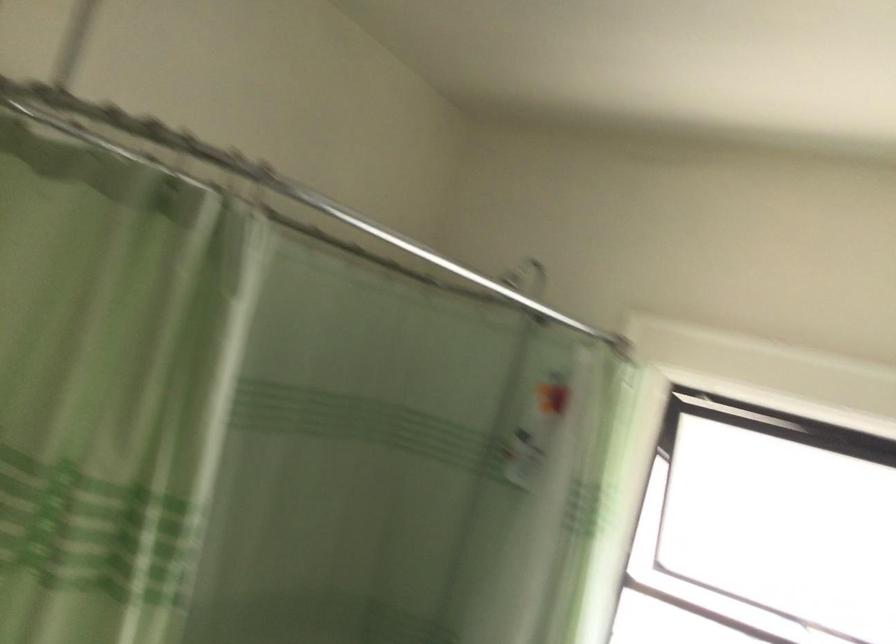
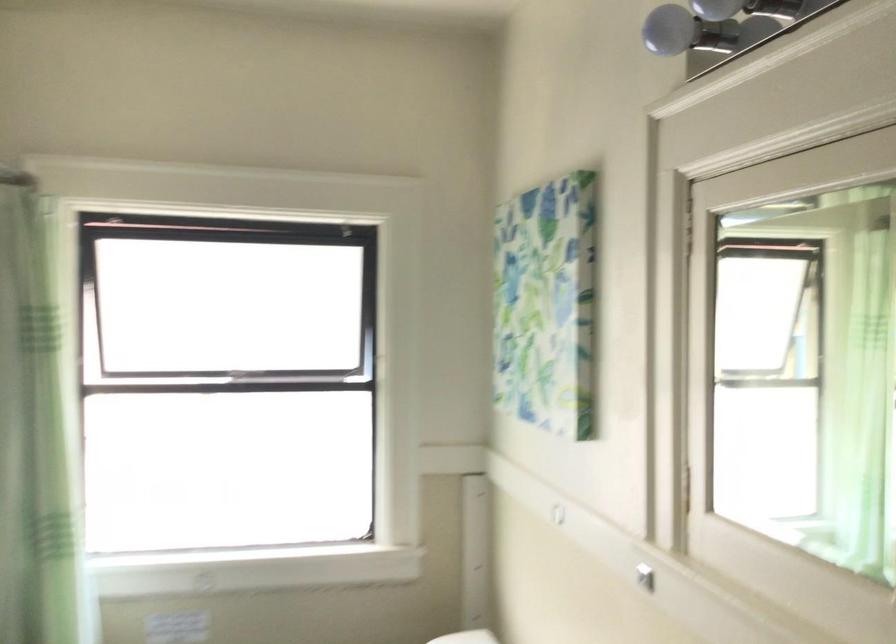
Question: The images are taken continuously from a first-person perspective. In which direction is your viewpoint rotating?

Choices:
 (A) Left
 (B) Right
 (C) Up
 (D) Down

Answer: (B)